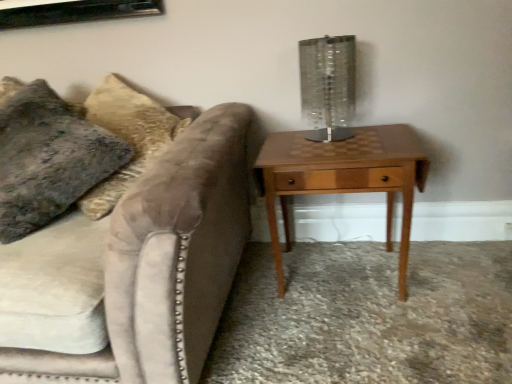
Question: Can you confirm if clear glass table lamp at upper right is shorter than velvety gray pillow at left?

Choices:
 (A) no
 (B) yes

Answer: (B)

Question: Does clear glass table lamp at upper right lie in front of velvety gray pillow at left?

Choices:
 (A) no
 (B) yes

Answer: (A)

Question: Is clear glass table lamp at upper right facing towards velvety gray pillow at left?

Choices:
 (A) no
 (B) yes

Answer: (A)

Question: Considering the relative sizes of clear glass table lamp at upper right and velvety gray pillow at left in the image provided, is clear glass table lamp at upper right wider than velvety gray pillow at left?

Choices:
 (A) no
 (B) yes

Answer: (A)

Question: Does clear glass table lamp at upper right appear on the right side of velvety gray pillow at left?

Choices:
 (A) yes
 (B) no

Answer: (A)

Question: Does clear glass table lamp at upper right have a lesser width compared to velvety gray pillow at left?

Choices:
 (A) no
 (B) yes

Answer: (B)

Question: Can you confirm if velvety gray pillow at left is positioned to the left of clear glass table lamp at upper right?

Choices:
 (A) no
 (B) yes

Answer: (B)

Question: Would you say velvety gray pillow at left is a long distance from clear glass table lamp at upper right?

Choices:
 (A) no
 (B) yes

Answer: (A)

Question: Considering the relative sizes of velvety gray pillow at left and clear glass table lamp at upper right in the image provided, is velvety gray pillow at left bigger than clear glass table lamp at upper right?

Choices:
 (A) yes
 (B) no

Answer: (A)

Question: Is velvety gray pillow at left positioned with its back to clear glass table lamp at upper right?

Choices:
 (A) yes
 (B) no

Answer: (B)

Question: Is velvety gray pillow at left behind clear glass table lamp at upper right?

Choices:
 (A) yes
 (B) no

Answer: (B)

Question: Is velvety gray pillow at left taller than clear glass table lamp at upper right?

Choices:
 (A) no
 (B) yes

Answer: (B)

Question: Is velvety gray pillow at left not near woodenmaterial/texturenightstand at right?

Choices:
 (A) yes
 (B) no

Answer: (B)